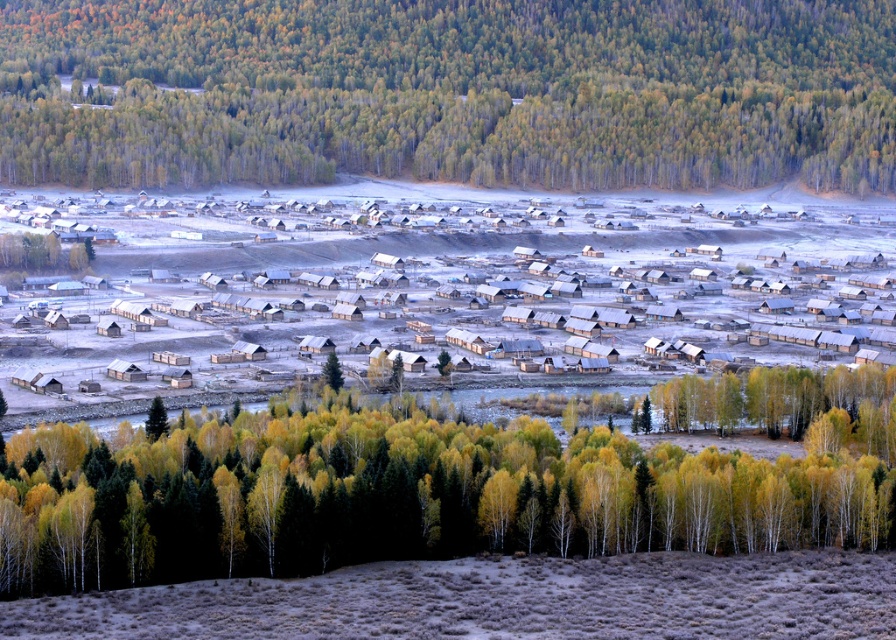
Is yellow-green leaves at center shorter than white wooden houses at center?

Yes.

Which of these two, yellow-green leaves at center or white wooden houses at center, stands taller?

white wooden houses at center

Is point (229, 420) closer to viewer compared to point (530, 337)?

Yes, it is in front of point (530, 337).

Locate an element on the screen. The image size is (896, 640). yellow-green leaves at center is located at coordinates (438, 486).

The height and width of the screenshot is (640, 896). Describe the element at coordinates (438, 486) in the screenshot. I see `yellow-green leaves at center` at that location.

This screenshot has height=640, width=896. Describe the element at coordinates (438, 486) in the screenshot. I see `yellow-green leaves at center` at that location.

Where is `yellow-green leaves at center`? The height and width of the screenshot is (640, 896). yellow-green leaves at center is located at coordinates (438, 486).

Which is more to the right, green matte forest at upper center or dry grassland at lower center?

dry grassland at lower center

Who is more distant from viewer, (x=497, y=92) or (x=750, y=604)?

The point (x=497, y=92) is behind.

Who is more forward, (196, 150) or (519, 630)?

Point (519, 630)

Where is `green matte forest at upper center`? This screenshot has width=896, height=640. green matte forest at upper center is located at coordinates (450, 92).